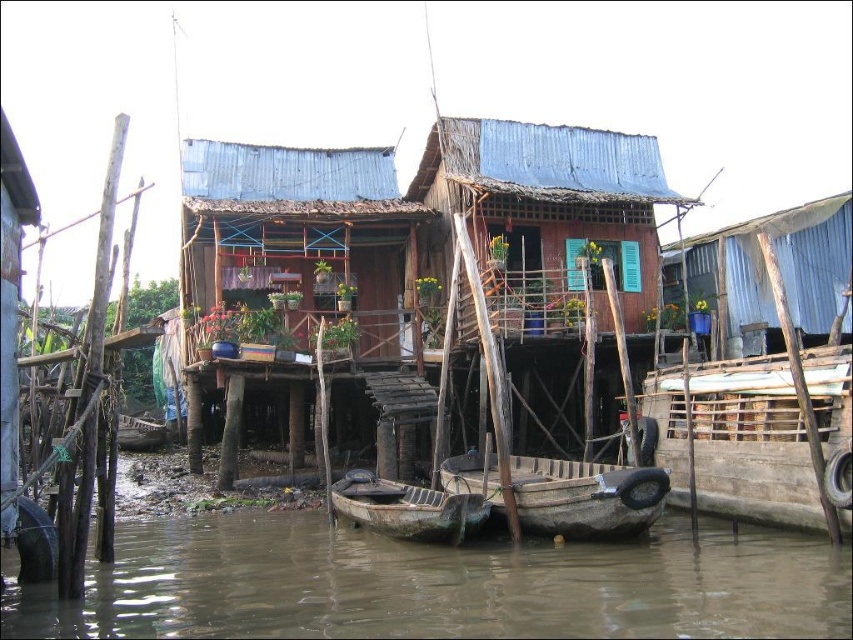
Question: Considering the relative positions of wooden planks boat at right and rusty metal boat at center in the image provided, where is wooden planks boat at right located with respect to rusty metal boat at center?

Choices:
 (A) right
 (B) left

Answer: (A)

Question: Where is brown muddy water at lower center located in relation to wooden boat at center in the image?

Choices:
 (A) right
 (B) left

Answer: (B)

Question: Does brown muddy water at lower center have a larger size compared to wooden hut at center?

Choices:
 (A) yes
 (B) no

Answer: (B)

Question: Which of these objects is positioned closest to the brown muddy water at lower center?

Choices:
 (A) wooden hut at center
 (B) rusty metal boat at center
 (C) wooden planks boat at right

Answer: (B)

Question: Which point appears closest to the camera in this image?

Choices:
 (A) (662, 424)
 (B) (633, 582)
 (C) (409, 289)
 (D) (637, 488)

Answer: (B)

Question: Which point is farther from the camera taking this photo?

Choices:
 (A) (267, 179)
 (B) (775, 561)
 (C) (730, 428)
 (D) (518, 483)

Answer: (A)